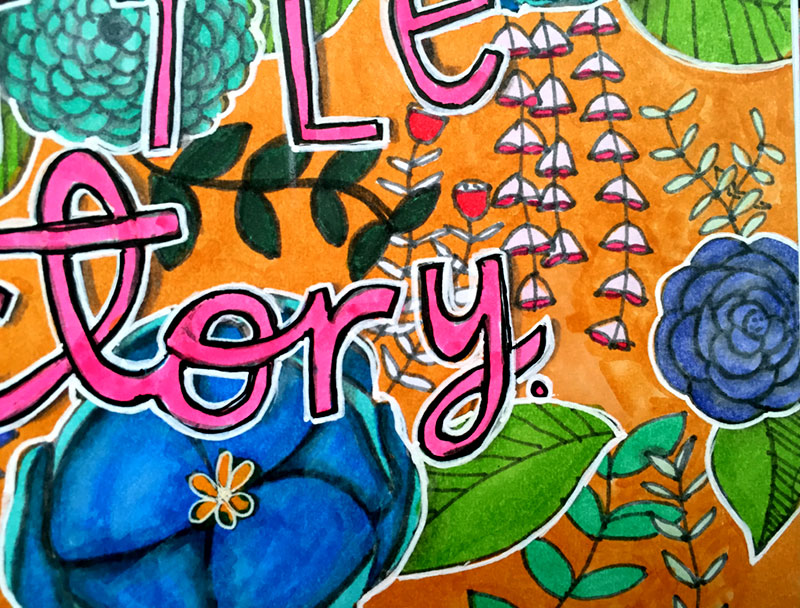
Identify the location of bigger leaf green plant. This screenshot has width=800, height=608. (630, 458).